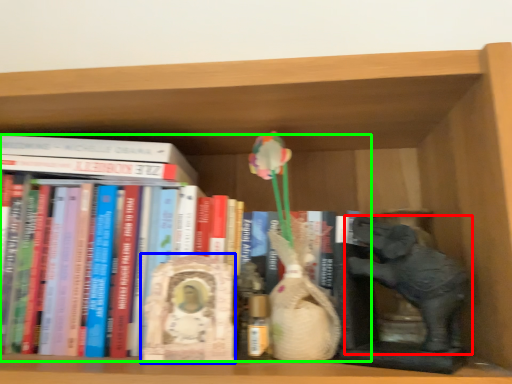
Question: Based on their relative distances, which object is nearer to elephant (highlighted by a red box)? Choose from sculpture (highlighted by a blue box) and book (highlighted by a green box).

Choices:
 (A) sculpture
 (B) book

Answer: (A)